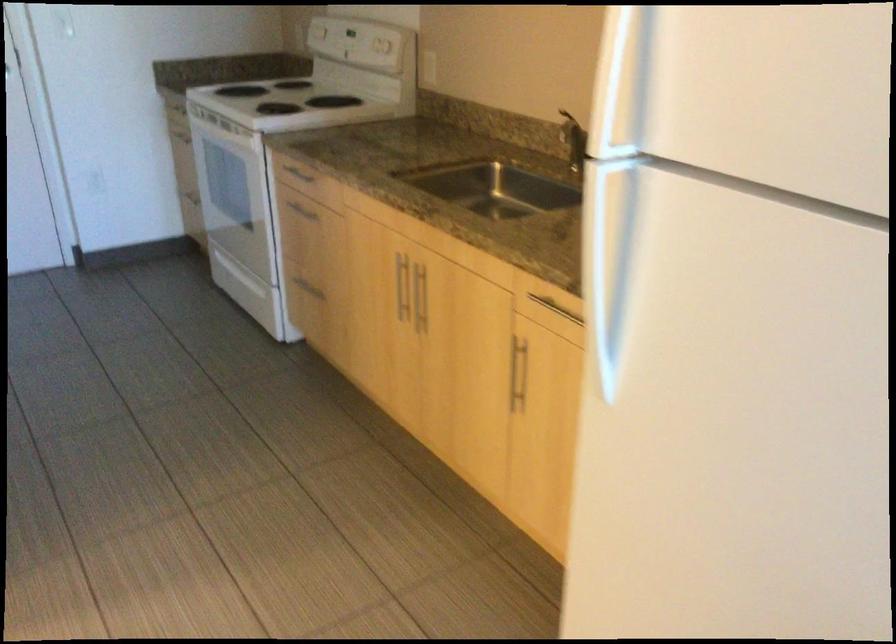
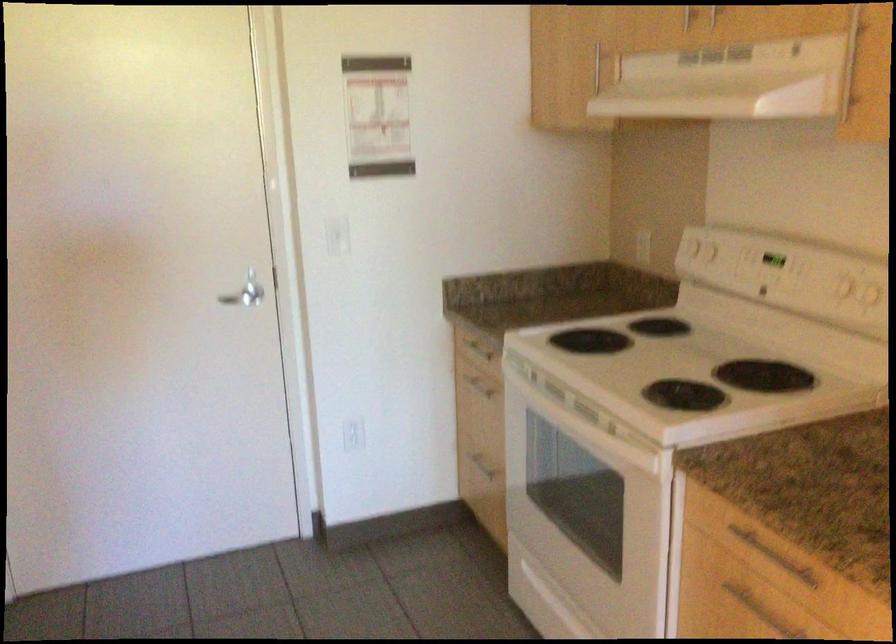
Locate, in the second image, the point that corresponds to [197,202] in the first image.

(478, 462)